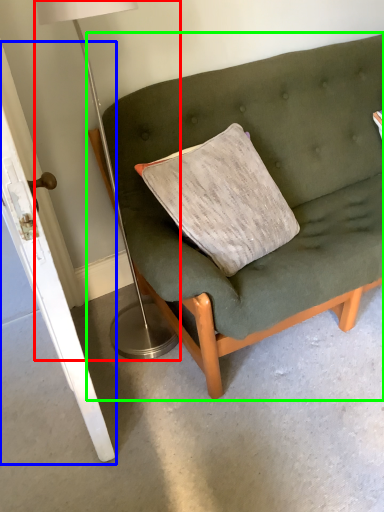
Question: Considering the real-world distances, which object is closest to table lamp (highlighted by a red box)? door (highlighted by a blue box) or studio couch (highlighted by a green box).

Choices:
 (A) door
 (B) studio couch

Answer: (A)